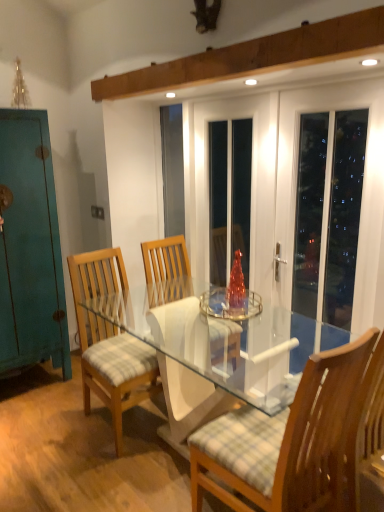
Question: From the image's perspective, is wooden chair with checkered cushion at center, which is the first chair in right-to-left order, located beneath teal matte cabinet at left?

Choices:
 (A) no
 (B) yes

Answer: (B)

Question: Does wooden chair with checkered cushion at center, marked as the second chair in a back-to-front arrangement, have a lesser width compared to teal matte cabinet at left?

Choices:
 (A) no
 (B) yes

Answer: (A)

Question: Is wooden chair with checkered cushion at center, placed as the second chair when sorted from left to right, beside teal matte cabinet at left?

Choices:
 (A) no
 (B) yes

Answer: (A)

Question: Is wooden chair with checkered cushion at center, the first chair in the front-to-back sequence, oriented towards teal matte cabinet at left?

Choices:
 (A) no
 (B) yes

Answer: (B)

Question: Considering the relative positions of wooden chair with checkered cushion at center, which is the first chair in right-to-left order, and teal matte cabinet at left in the image provided, is wooden chair with checkered cushion at center, which is the first chair in right-to-left order, to the left of teal matte cabinet at left from the viewer's perspective?

Choices:
 (A) yes
 (B) no

Answer: (B)

Question: Is wooden chair with checkered cushion at center, the first chair in the front-to-back sequence, positioned behind teal matte cabinet at left?

Choices:
 (A) yes
 (B) no

Answer: (B)

Question: From a real-world perspective, is light brown wood chair at center, marked as the 1th chair in a back-to-front arrangement, on white glossy door at upper right?

Choices:
 (A) no
 (B) yes

Answer: (A)

Question: Can you confirm if light brown wood chair at center, marked as the 1th chair in a back-to-front arrangement, is shorter than white glossy door at upper right?

Choices:
 (A) no
 (B) yes

Answer: (B)

Question: From the image's perspective, is light brown wood chair at center, which is the 1th chair from left to right, above white glossy door at upper right?

Choices:
 (A) no
 (B) yes

Answer: (A)

Question: Is light brown wood chair at center, the second chair viewed from the right, aimed at white glossy door at upper right?

Choices:
 (A) no
 (B) yes

Answer: (A)

Question: Is light brown wood chair at center, which ranks as the 2th chair in front-to-back order, bigger than white glossy door at upper right?

Choices:
 (A) no
 (B) yes

Answer: (B)

Question: Considering the relative positions of light brown wood chair at center, which ranks as the 2th chair in front-to-back order, and white glossy door at upper right in the image provided, is light brown wood chair at center, which ranks as the 2th chair in front-to-back order, in front of white glossy door at upper right?

Choices:
 (A) yes
 (B) no

Answer: (B)

Question: From a real-world perspective, is light brown wood chair at center, marked as the 1th chair in a back-to-front arrangement, physically above teal matte cabinet at left?

Choices:
 (A) no
 (B) yes

Answer: (A)